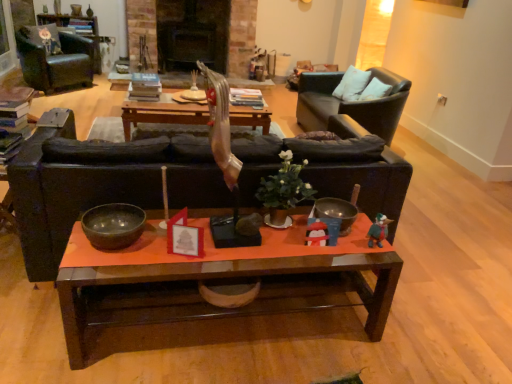
Image resolution: width=512 pixels, height=384 pixels. I want to click on vacant space in front of green matte plant at center, so click(x=282, y=249).